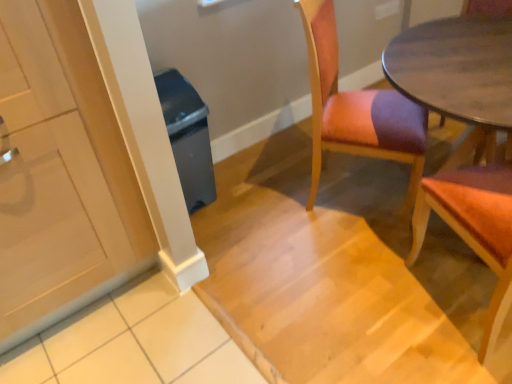
You are a GUI agent. You are given a task and a screenshot of the screen. Output one action in this format:
    pyautogui.click(x=<x>, y=<y>)
    Task: Click on the vacant area that lies between wooden upholstered chair at center, the first chair viewed from the left, and gray plastic trash can at left
    
    Given the screenshot: What is the action you would take?
    pyautogui.click(x=257, y=193)